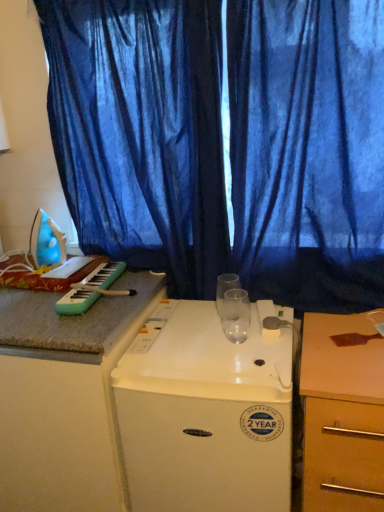
Question: From their relative heights in the image, would you say blue sheer curtain at upper center, the second curtain positioned from the right, is taller or shorter than blue fabric curtain at center, marked as the 1th curtain in a right-to-left arrangement?

Choices:
 (A) tall
 (B) short

Answer: (B)

Question: Is blue sheer curtain at upper center, the second curtain positioned from the right, wider or thinner than blue fabric curtain at center, marked as the second curtain in a left-to-right arrangement?

Choices:
 (A) wide
 (B) thin

Answer: (B)

Question: Based on their relative distances, which object is farther from the green plastic keyboard at left?

Choices:
 (A) white plastic refrigerator at center
 (B) blue fabric curtain at center, marked as the second curtain in a left-to-right arrangement
 (C) blue plastic iron at left
 (D) wooden at right
 (E) blue sheer curtain at upper center, which ranks as the first curtain in left-to-right order

Answer: (D)

Question: Estimate the real-world distances between objects in this image. Which object is closer to the blue plastic iron at left?

Choices:
 (A) blue sheer curtain at upper center, which ranks as the first curtain in left-to-right order
 (B) white plastic refrigerator at center
 (C) blue fabric curtain at center, marked as the 1th curtain in a right-to-left arrangement
 (D) green plastic keyboard at left
 (E) wooden at right

Answer: (D)